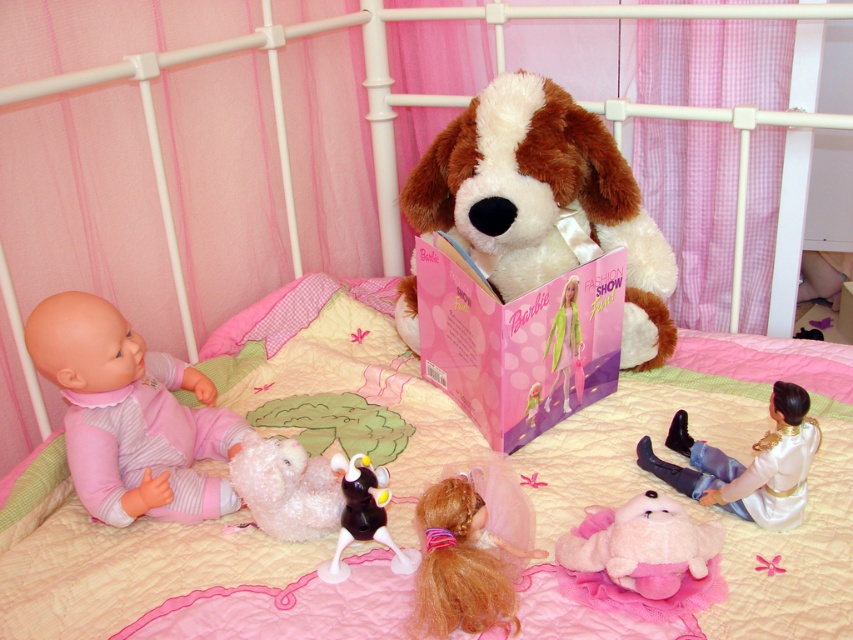
Question: Which point is farther to the camera?

Choices:
 (A) fluffy pink plush at center
 (B) white glossy doll at lower right

Answer: (B)

Question: Considering the real-world distances, which object is farthest from the fluffy white teddy bear at center?

Choices:
 (A) fluffy pink plush at center
 (B) shiny plastic cow at center

Answer: (A)

Question: Is shiny plastic cow at center bigger than matte pink barbie doll at center?

Choices:
 (A) yes
 (B) no

Answer: (B)

Question: Can you confirm if white glossy doll at lower right is thinner than fluffy pink plush at center?

Choices:
 (A) yes
 (B) no

Answer: (A)

Question: Which point is farther to the camera?

Choices:
 (A) (608, 515)
 (B) (86, 390)
 (C) (416, 561)

Answer: (B)

Question: Is fluffy brown-white teddy bear at center wider than fluffy white teddy bear at center?

Choices:
 (A) yes
 (B) no

Answer: (A)